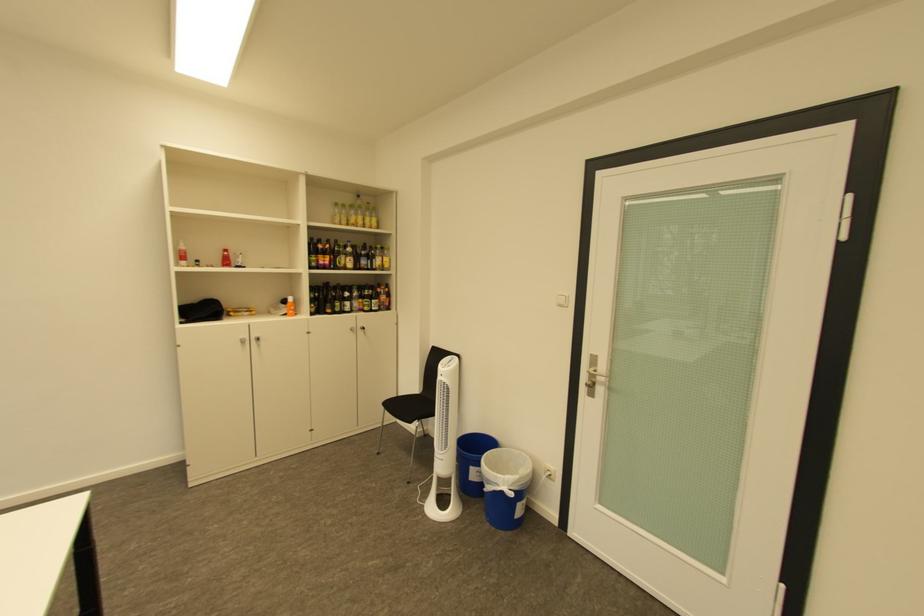
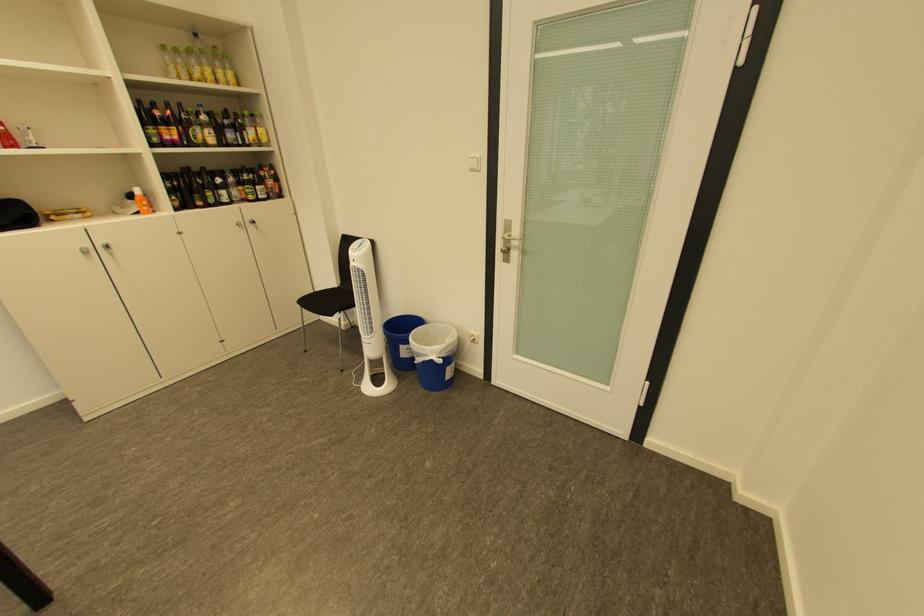
In the second image, find the point that corresponds to the point at 347,216 in the first image.

(180, 66)